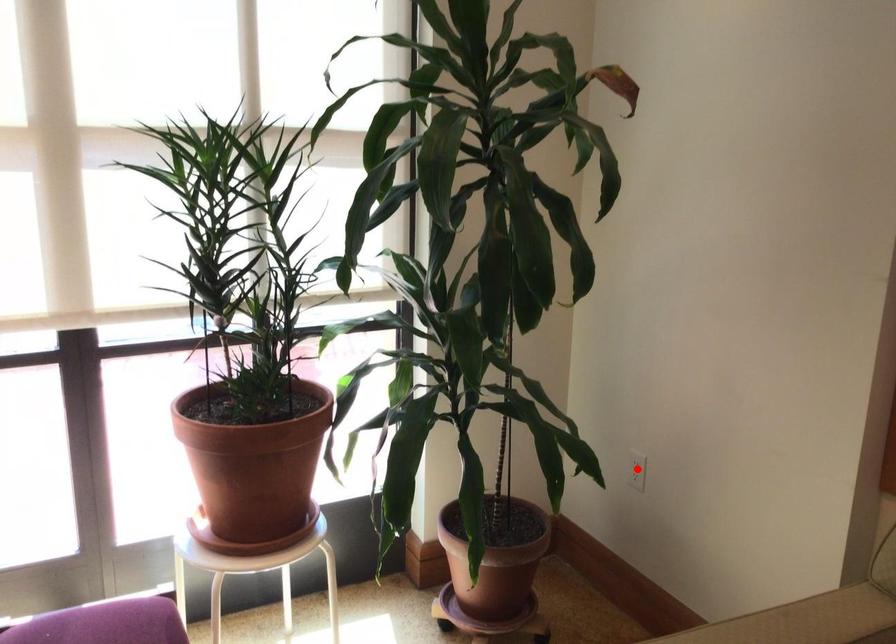
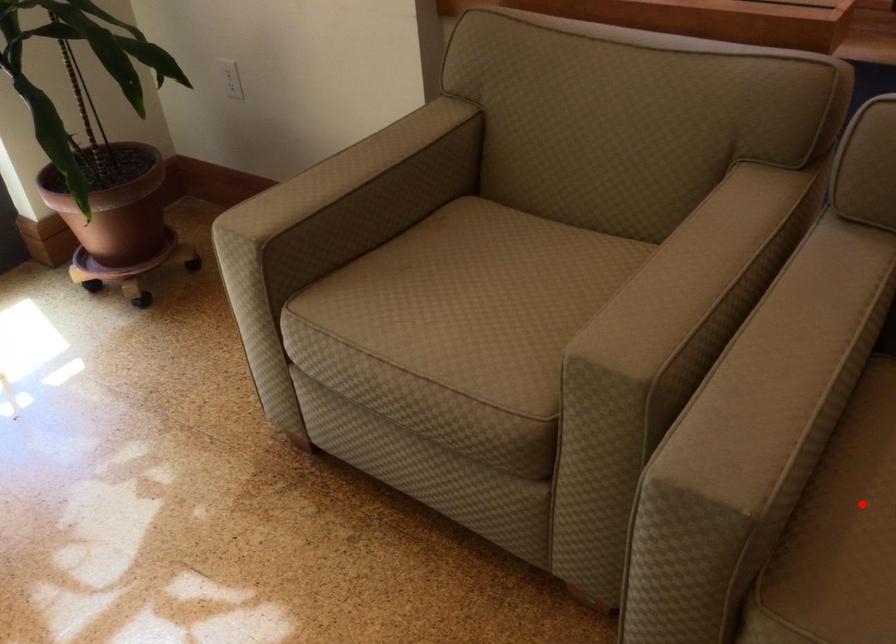
I am providing you with two images of the same scene from different viewpoints. A red point is marked on the first image and another point is marked on the second image. Is the red point in image1 aligned with the point shown in image2?

No